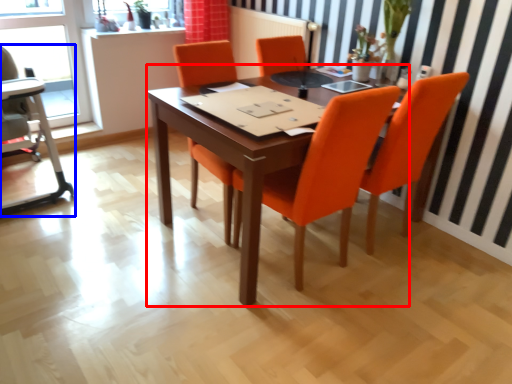
Question: Which point is closer to the camera, table (highlighted by a red box) or armchair (highlighted by a blue box)?

Choices:
 (A) table
 (B) armchair

Answer: (A)